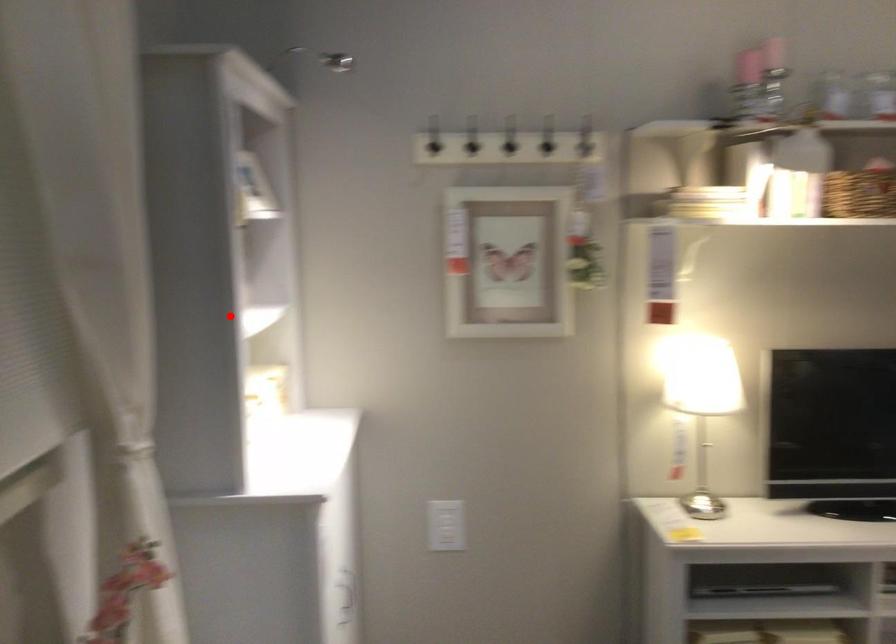
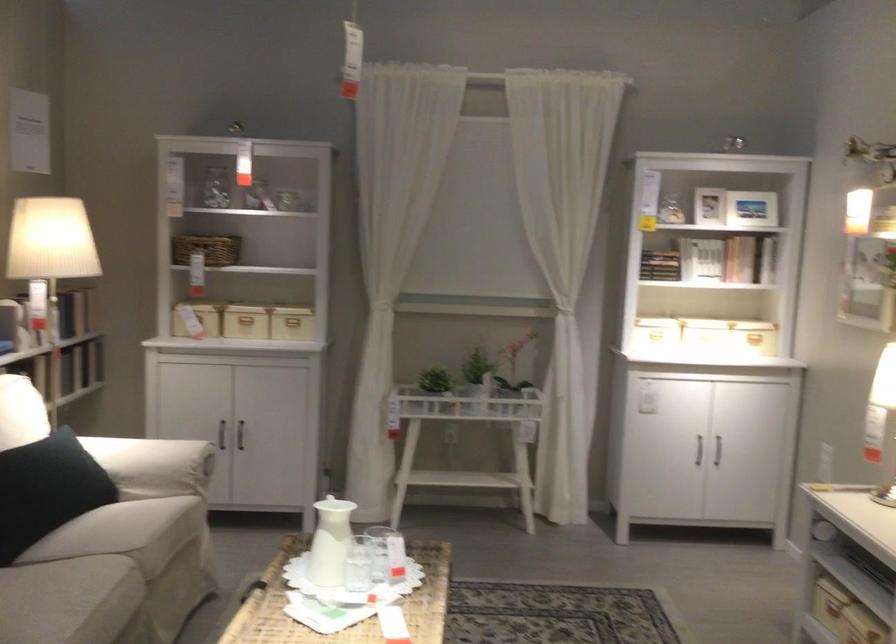
Question: I am providing you with two images of the same scene from different viewpoints. Image1 has a red point marked. In image2, the corresponding 3D location appears at what relative position? Reply with the corresponding letter.

Choices:
 (A) Closer
 (B) Farther

Answer: (B)